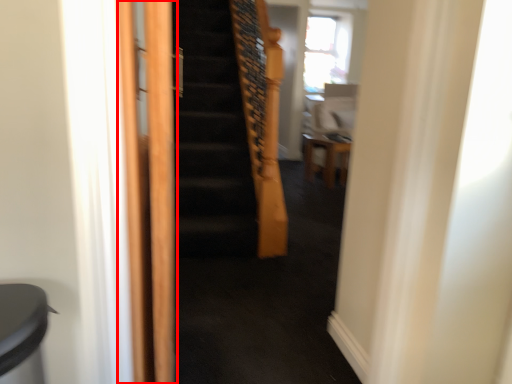
Question: Observing the image, what is the correct spatial positioning of screen door (annotated by the red box) in reference to furniture?

Choices:
 (A) right
 (B) left

Answer: (B)